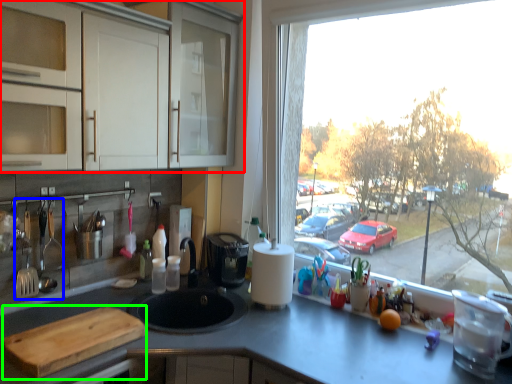
Question: Which object is positioned farthest from cabinetry (highlighted by a red box)? Select from silverware (highlighted by a blue box) and cutting board (highlighted by a green box).

Choices:
 (A) silverware
 (B) cutting board

Answer: (B)